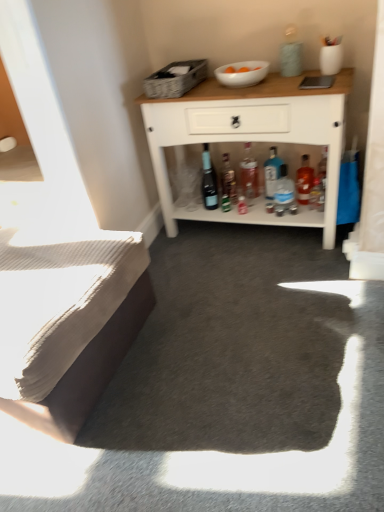
Locate an element on the screen. The height and width of the screenshot is (512, 384). vacant area that is in front of white glossy bowl at upper center is located at coordinates (253, 90).